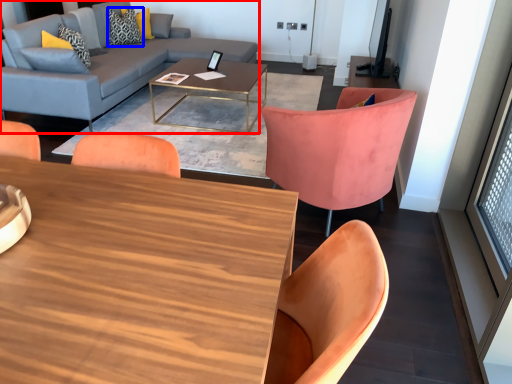
Question: Among these objects, which one is nearest to the camera, studio couch (highlighted by a red box) or pillow (highlighted by a blue box)?

Choices:
 (A) studio couch
 (B) pillow

Answer: (A)